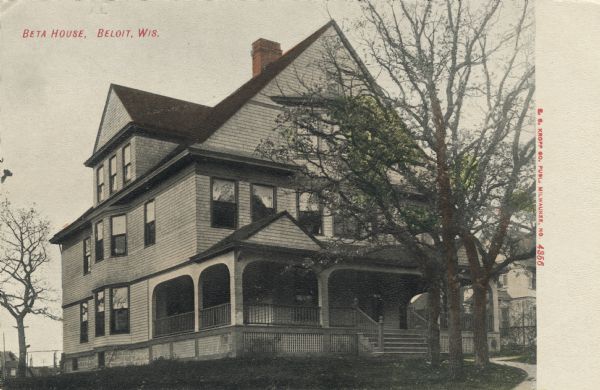
At what (x,y) coordinates should I click in order to perform the action: click on chimney. Please return your answer as a coordinate pair (x, y). Looking at the image, I should click on (262, 41).